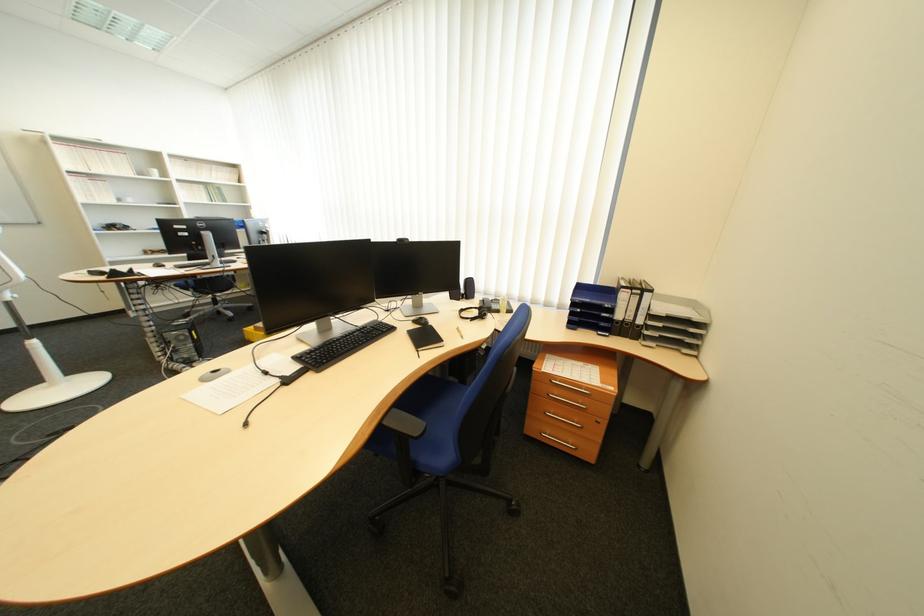
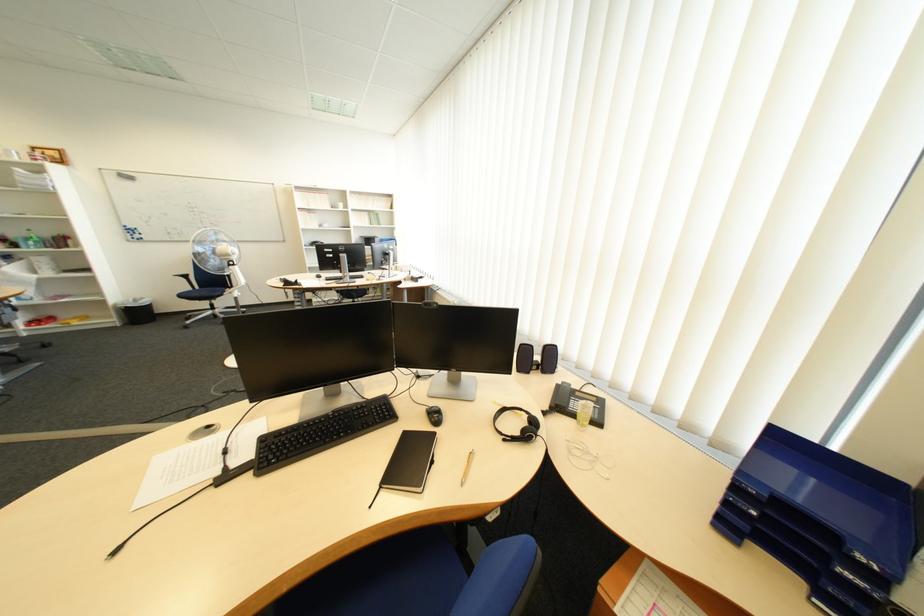
Locate, in the second image, the point that corresponds to point 591,312 in the first image.

(767, 514)